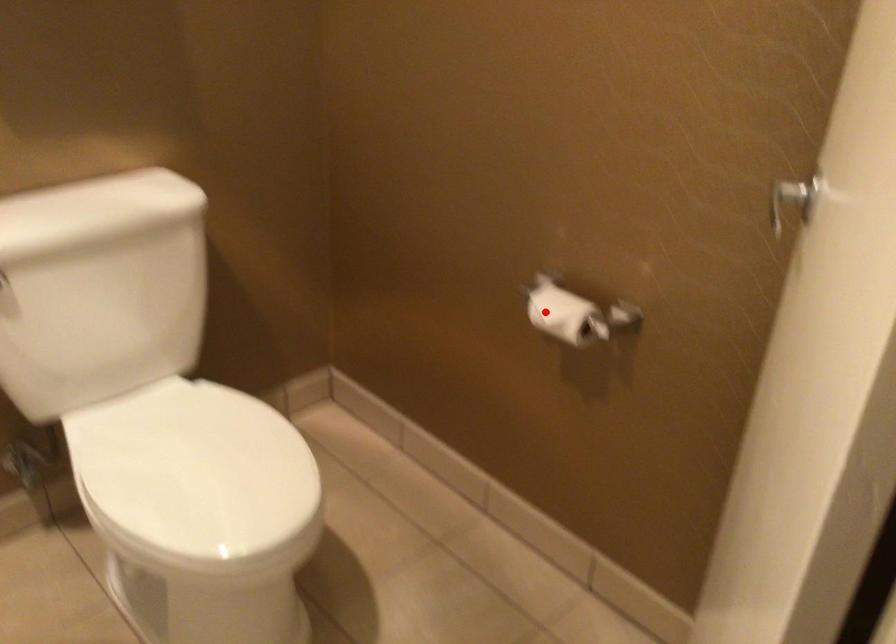
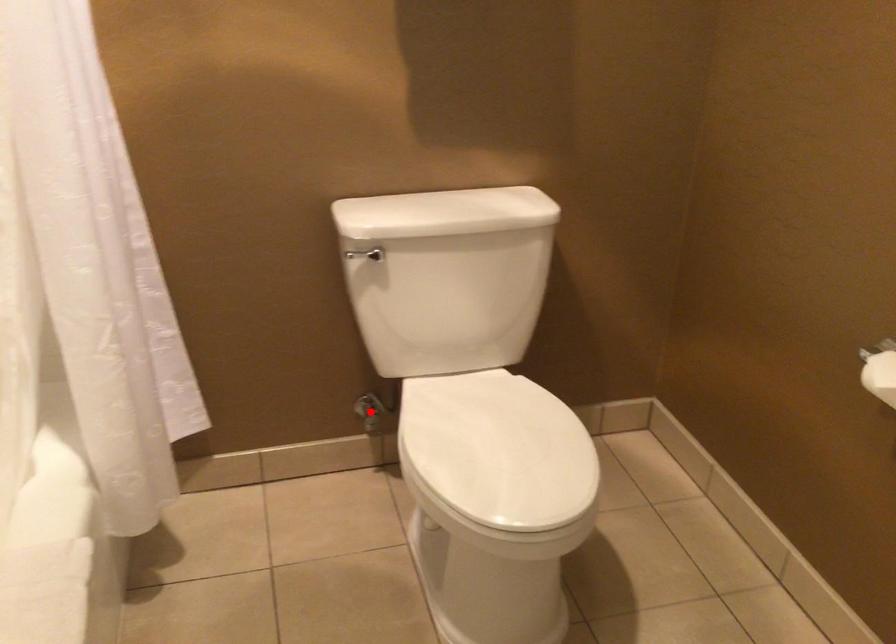
I am providing you with two images of the same scene from different viewpoints. A red point is marked on the first image and another point is marked on the second image. Is the red point in image1 aligned with the point shown in image2?

No